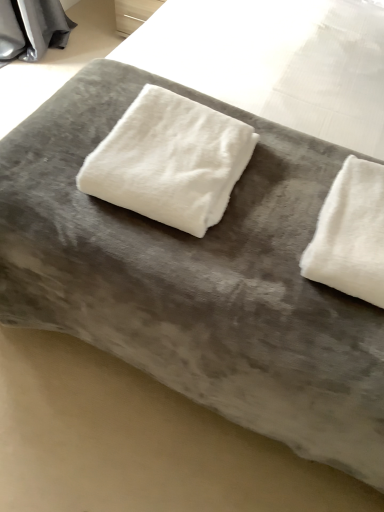
The height and width of the screenshot is (512, 384). Identify the location of vacant area to the right of white fluffy towel at center, marked as the 2th towel in a right-to-left arrangement. [x=280, y=186].